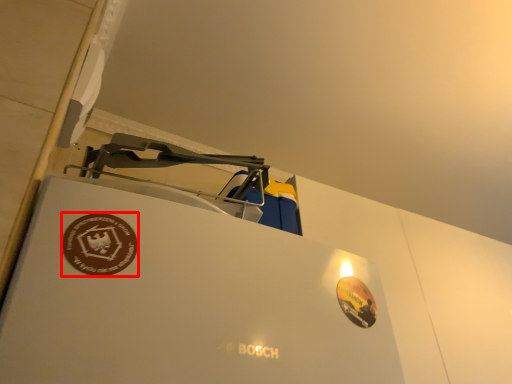
Question: Where is logo (annotated by the red box) located in relation to logo in the image?

Choices:
 (A) left
 (B) right

Answer: (A)